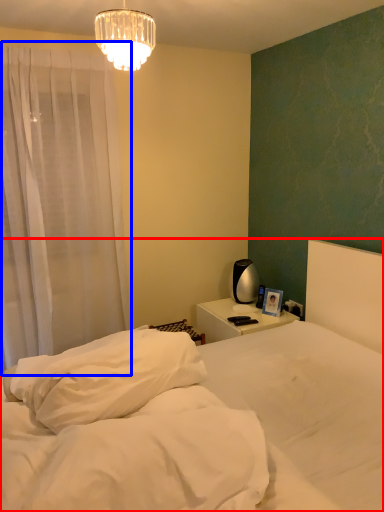
Question: Which of the following is the farthest to the observer, bed (highlighted by a red box) or curtain (highlighted by a blue box)?

Choices:
 (A) bed
 (B) curtain

Answer: (B)